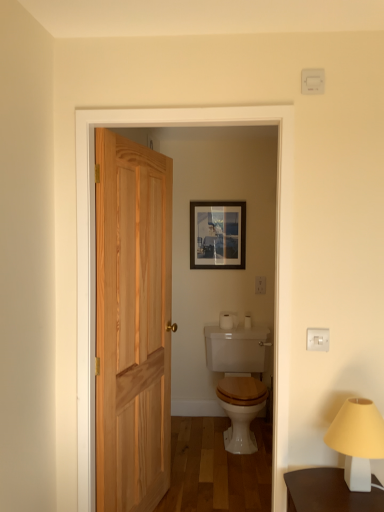
Find the location of a particular element. free space to the left of white glossy toilet at center is located at coordinates (194, 436).